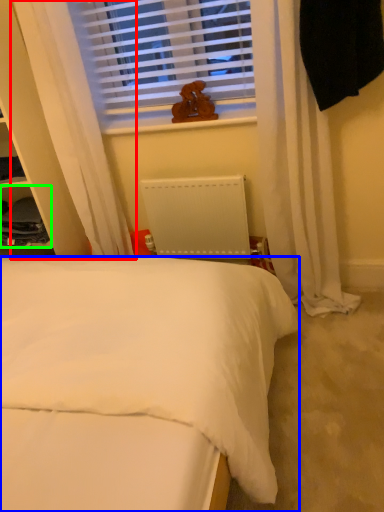
Question: Which object is the farthest from curtain (highlighted by a red box)? Choose among these: bed (highlighted by a blue box) or cabinet (highlighted by a green box).

Choices:
 (A) bed
 (B) cabinet

Answer: (A)